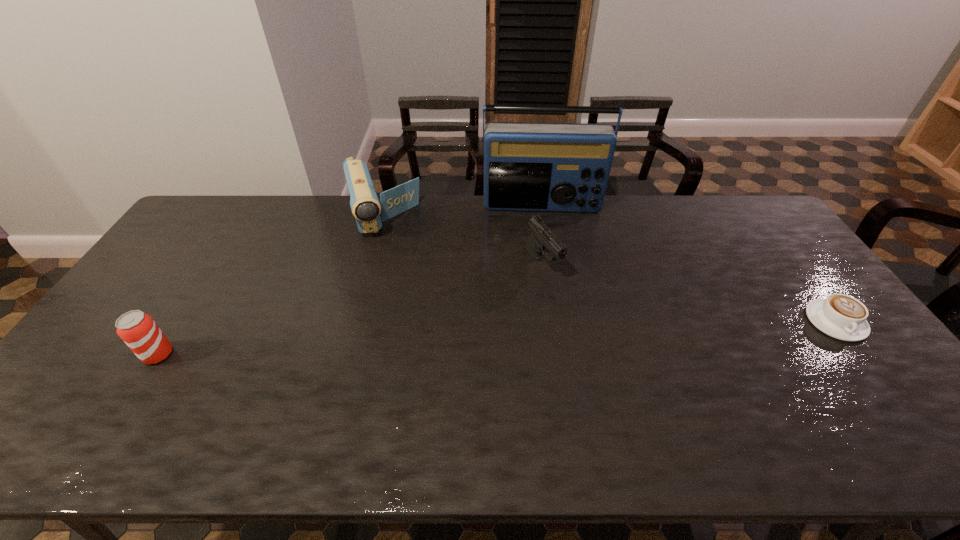
Where is `vacant area situated 0.180m on the front panel of the radio receiver`? Image resolution: width=960 pixels, height=540 pixels. vacant area situated 0.180m on the front panel of the radio receiver is located at coordinates (544, 250).

At what (x,y) coordinates should I click in order to perform the action: click on free space located on the front panel of the radio receiver. Please return your answer as a coordinate pair (x, y). The image size is (960, 540). Looking at the image, I should click on (543, 240).

This screenshot has height=540, width=960. Identify the location of free space located on the front panel of the radio receiver. (543, 246).

You are a GUI agent. You are given a task and a screenshot of the screen. Output one action in this format:
    pyautogui.click(x=<x>, y=<y>)
    Task: Click on the free space located on the side of the fourth object from right to left with the flip-out screen
    Image resolution: width=960 pixels, height=540 pixels.
    Given the screenshot: What is the action you would take?
    pyautogui.click(x=411, y=320)

This screenshot has width=960, height=540. What are the coordinates of `free region located 0.180m on the side of the fourth object from right to left with the flip-out screen` in the screenshot? It's located at pyautogui.click(x=398, y=280).

I want to click on vacant space located on the side of the fourth object from right to left with the flip-out screen, so click(x=398, y=280).

Locate an element on the screen. The height and width of the screenshot is (540, 960). free location located 0.230m at the barrel of the pistol is located at coordinates (595, 338).

Where is `free location located 0.120m at the barrel of the pistol`? The height and width of the screenshot is (540, 960). free location located 0.120m at the barrel of the pistol is located at coordinates (573, 309).

Where is `free location located 0.230m at the barrel of the pistol`? The image size is (960, 540). free location located 0.230m at the barrel of the pistol is located at coordinates (595, 338).

Where is `radio receiver situated at the far edge`? radio receiver situated at the far edge is located at coordinates (554, 167).